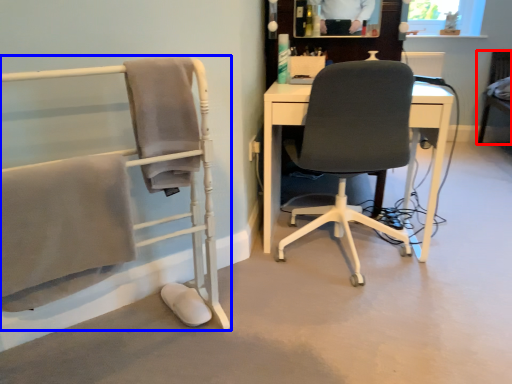
Question: Which point is closer to the camera, chair (highlighted by a red box) or chair (highlighted by a blue box)?

Choices:
 (A) chair
 (B) chair

Answer: (B)